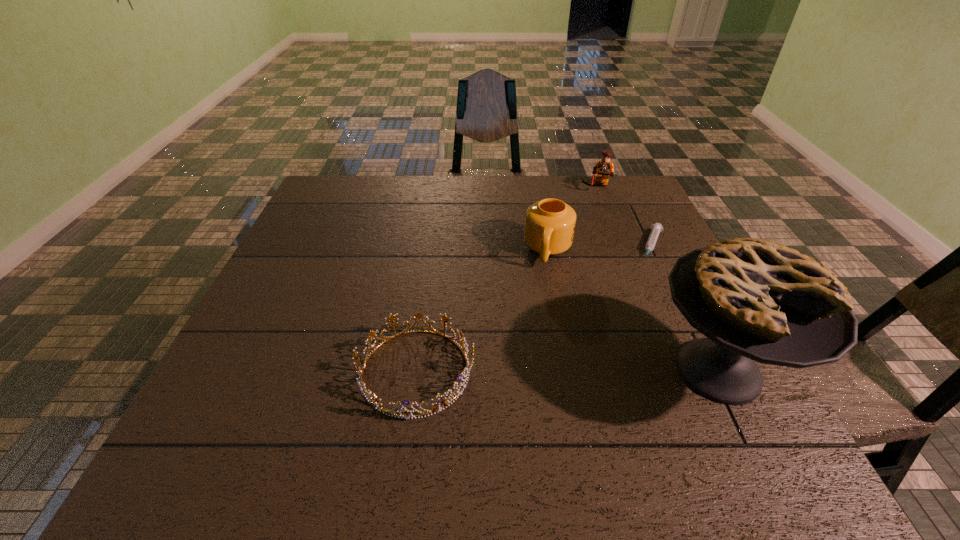
Identify the location of vacant space on the desktop that is between the leftmost object and the pie and is positioned at the needle end of the shortest object. pyautogui.click(x=605, y=371).

You are a GUI agent. You are given a task and a screenshot of the screen. Output one action in this format:
    pyautogui.click(x=<x>, y=<y>)
    Task: Click on the vacant space on the desktop that is between the leftmost object and the tallest object and is positioned holding a crossbow in the hands of the farthest object
    
    Given the screenshot: What is the action you would take?
    pyautogui.click(x=561, y=371)

Identify the location of vacant space on the desktop that is between the leftmost object and the tallest object and is positioned on the handle side of the fourth object from right to left. Image resolution: width=960 pixels, height=540 pixels. (522, 371).